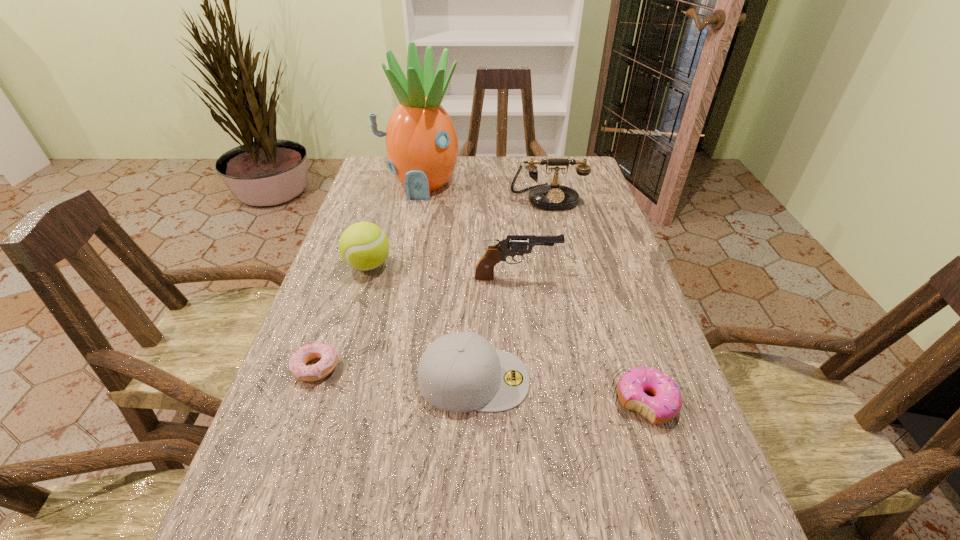
What are the coordinates of `vacant space that is in between the cap and the pineapple` in the screenshot? It's located at (447, 281).

Locate an element on the screen. unoccupied position between the cap and the telephone is located at coordinates (511, 288).

The width and height of the screenshot is (960, 540). Identify the location of vacant area between the pineapple and the telephone. (484, 191).

Find the location of a particular element. The width and height of the screenshot is (960, 540). free area in between the sixth tallest object and the fifth tallest object is located at coordinates (560, 390).

The height and width of the screenshot is (540, 960). Identify the location of free space between the tennis ball and the gun. (443, 272).

Find the location of a particular element. object identified as the closest to the tennis ball is located at coordinates (484, 271).

Select which object appears as the third closest to the sixth tallest object. Please provide its 2D coordinates. Your answer should be formatted as a tuple, i.e. [(x, y)], where the tuple contains the x and y coordinates of a point satisfying the conditions above.

[(297, 364)]

Image resolution: width=960 pixels, height=540 pixels. What are the coordinates of `free spot that satisfies the following two spatial constraints: 1. at the entrance of the taller doughnut; 2. on the right side of the pineapple` in the screenshot? It's located at (376, 402).

The image size is (960, 540). I want to click on vacant region that satisfies the following two spatial constraints: 1. on the dial of the telephone; 2. along the barrel of the gun, so click(564, 278).

At what (x,y) coordinates should I click in order to perform the action: click on free location that satisfies the following two spatial constraints: 1. on the front-facing side of the third shortest object; 2. on the right side of the taller doughnut. Please return your answer as a coordinate pair (x, y). This screenshot has height=540, width=960. Looking at the image, I should click on (473, 402).